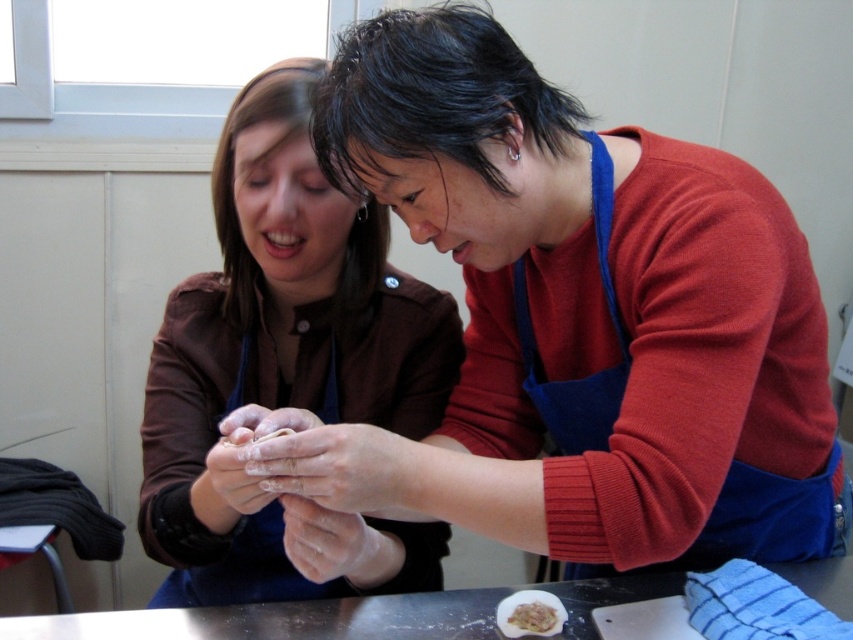
Question: Is the position of white floury hand at center less distant than that of white fluffy dough at lower center?

Choices:
 (A) no
 (B) yes

Answer: (B)

Question: Estimate the real-world distances between objects in this image. Which object is farther from the white floury hand at center?

Choices:
 (A) white floury hands at center
 (B) metallic silver table at center
 (C) white fluffy dough at lower center
 (D) matte brown apron at center

Answer: (D)

Question: Among these points, which one is farthest from the camera?

Choices:
 (A) (397, 353)
 (B) (305, 637)

Answer: (A)

Question: Can you confirm if white floury hands at center is positioned to the right of white fluffy dough at lower center?

Choices:
 (A) yes
 (B) no

Answer: (B)

Question: Which is farther from the white floury hand at center?

Choices:
 (A) white fluffy dough at lower center
 (B) white floury hands at center

Answer: (A)

Question: Does matte brown apron at center appear on the right side of white floury hands at center?

Choices:
 (A) yes
 (B) no

Answer: (B)